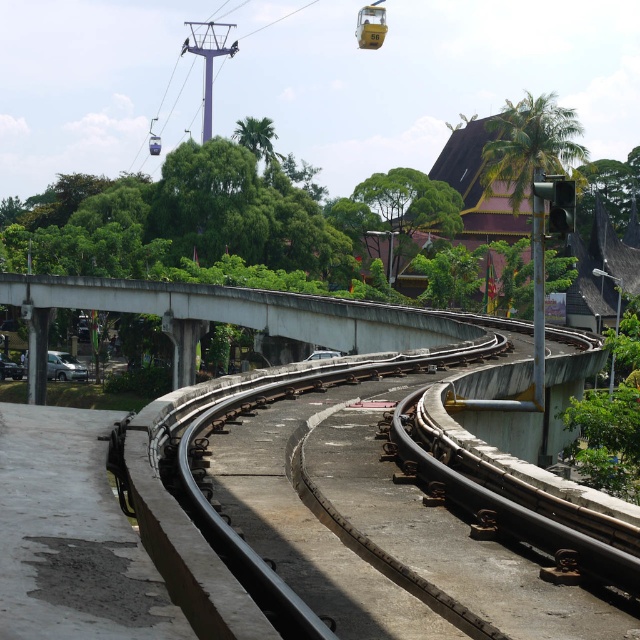
Who is lower down, concrete at left or metallic silver cable car at lower left?

metallic silver cable car at lower left is below.

The image size is (640, 640). What do you see at coordinates (234, 316) in the screenshot? I see `concrete at left` at bounding box center [234, 316].

The width and height of the screenshot is (640, 640). Identify the location of concrete at left. (234, 316).